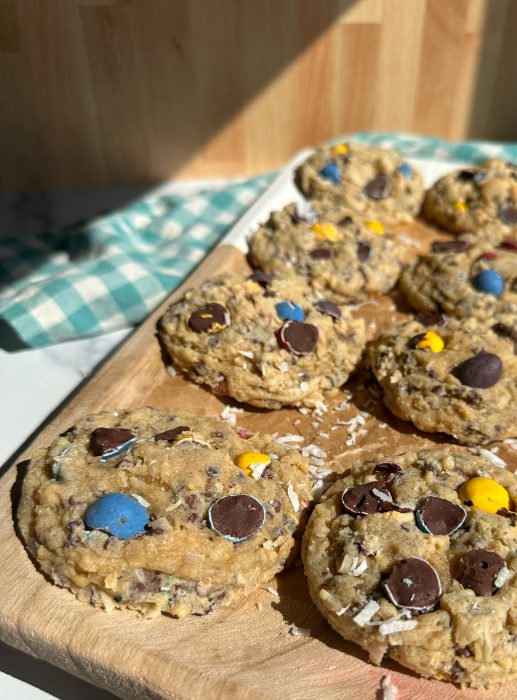
This screenshot has width=517, height=700. Identify the location of white side of tray. (281, 194).